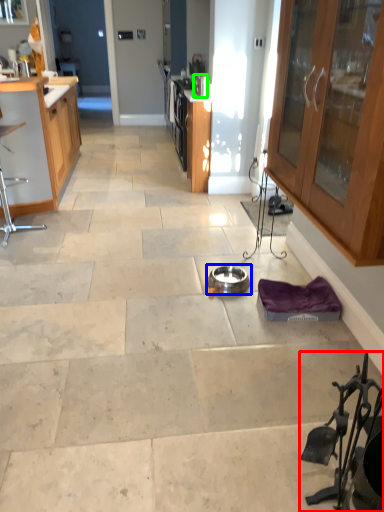
Question: Estimate the real-world distances between objects in this image. Which object is farther from chair (highlighted by a red box), appliance (highlighted by a blue box) or appliance (highlighted by a green box)?

Choices:
 (A) appliance
 (B) appliance

Answer: (B)